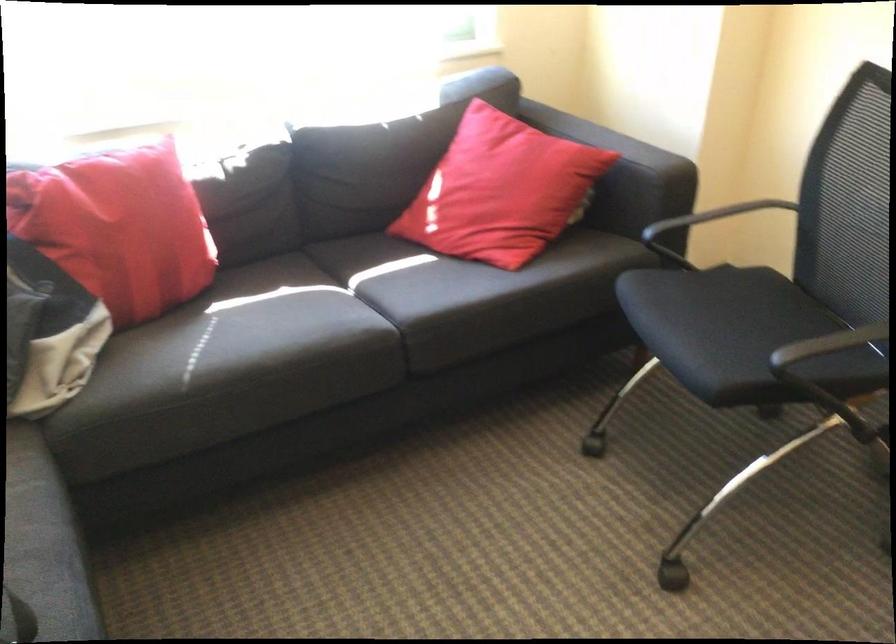
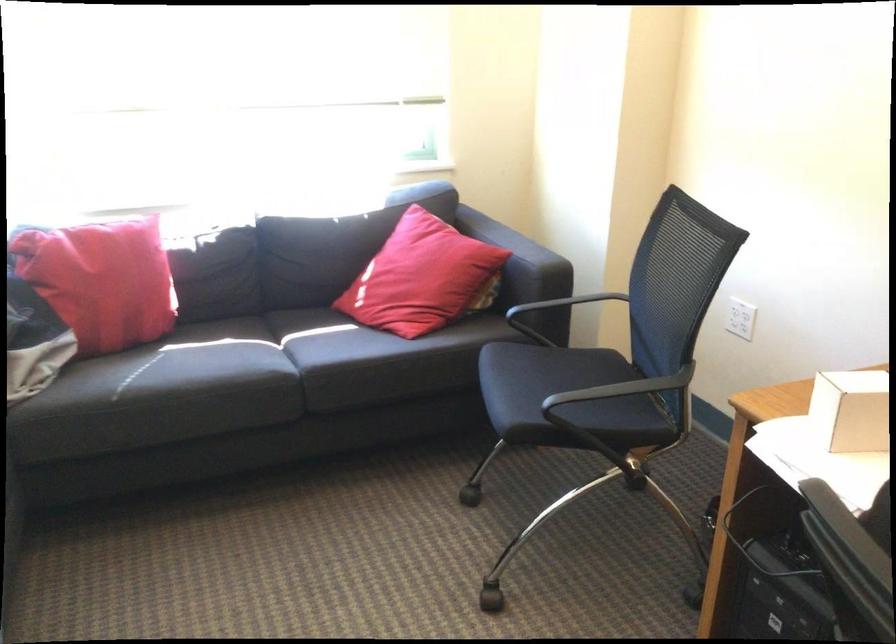
In a continuous first-person perspective shot, in which direction is the camera moving?

The cameraman moved toward right, backward.